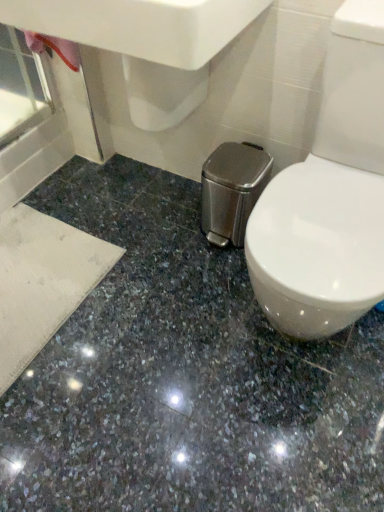
Question: Considering the relative positions of white glossy sink at upper center and shiny granite floor at center in the image provided, is white glossy sink at upper center to the left or to the right of shiny granite floor at center?

Choices:
 (A) left
 (B) right

Answer: (A)

Question: In the image, is white glossy sink at upper center positioned in front of or behind shiny granite floor at center?

Choices:
 (A) front
 (B) behind

Answer: (B)

Question: From the image's perspective, is white glossy sink at upper center located above or below shiny granite floor at center?

Choices:
 (A) below
 (B) above

Answer: (B)

Question: Would you say shiny granite floor at center is to the left or to the right of white glossy sink at upper center in the picture?

Choices:
 (A) right
 (B) left

Answer: (A)

Question: In terms of height, does shiny granite floor at center look taller or shorter compared to white glossy sink at upper center?

Choices:
 (A) short
 (B) tall

Answer: (A)

Question: Is shiny granite floor at center inside or outside of white glossy sink at upper center?

Choices:
 (A) outside
 (B) inside

Answer: (A)

Question: In terms of width, does shiny granite floor at center look wider or thinner when compared to white glossy sink at upper center?

Choices:
 (A) thin
 (B) wide

Answer: (B)